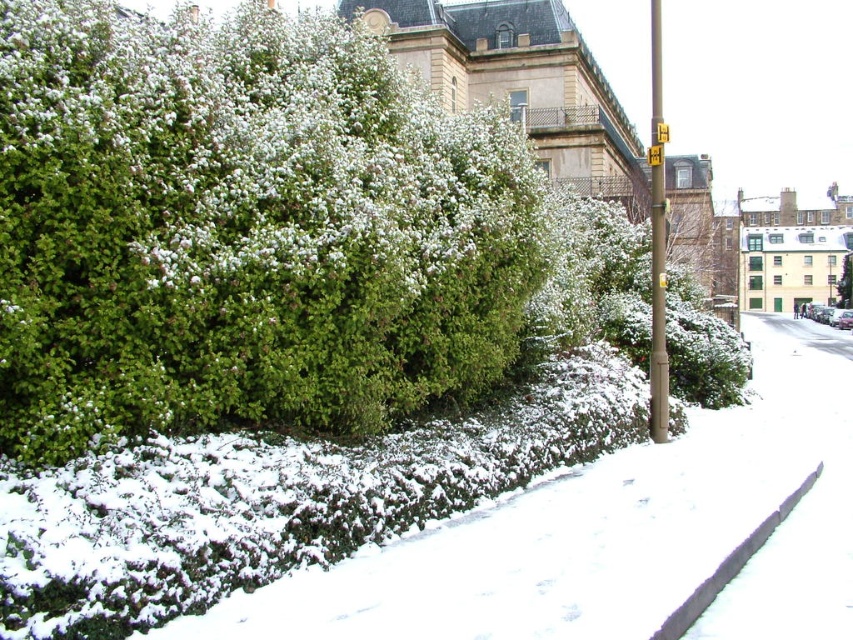
Can you confirm if green leafy bush at center is positioned above brown metallic pole at right?

Actually, green leafy bush at center is below brown metallic pole at right.

Does green leafy bush at center have a greater width compared to brown metallic pole at right?

No, green leafy bush at center is not wider than brown metallic pole at right.

Is point (173, 428) farther from viewer compared to point (659, 358)?

No, (173, 428) is closer to viewer.

Locate an element on the screen. This screenshot has width=853, height=640. green leafy bush at center is located at coordinates (242, 230).

Is point (746, 632) closer to camera compared to point (798, 484)?

Yes, point (746, 632) is closer to viewer.

Locate an element on the screen. The image size is (853, 640). green grass at lower left is located at coordinates (607, 532).

Does green leafy bush at center appear over metallic rectangular at upper right?

No, green leafy bush at center is not above metallic rectangular at upper right.

Does point (20, 412) come farther from viewer compared to point (656, 122)?

No.

Identify the location of green leafy bush at center. (242, 230).

Image resolution: width=853 pixels, height=640 pixels. What are the coordinates of `green leafy bush at center` in the screenshot? It's located at (242, 230).